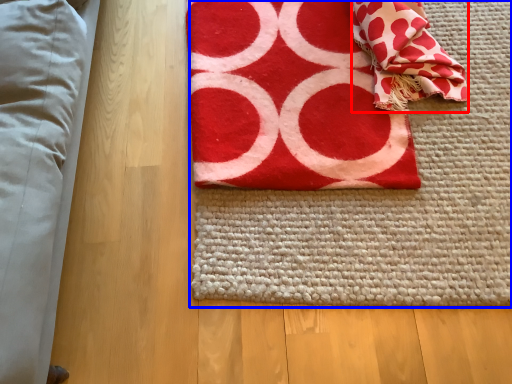
Question: Which of the following is the farthest to the observer, blanket (highlighted by a red box) or yoga mat (highlighted by a blue box)?

Choices:
 (A) blanket
 (B) yoga mat

Answer: (A)